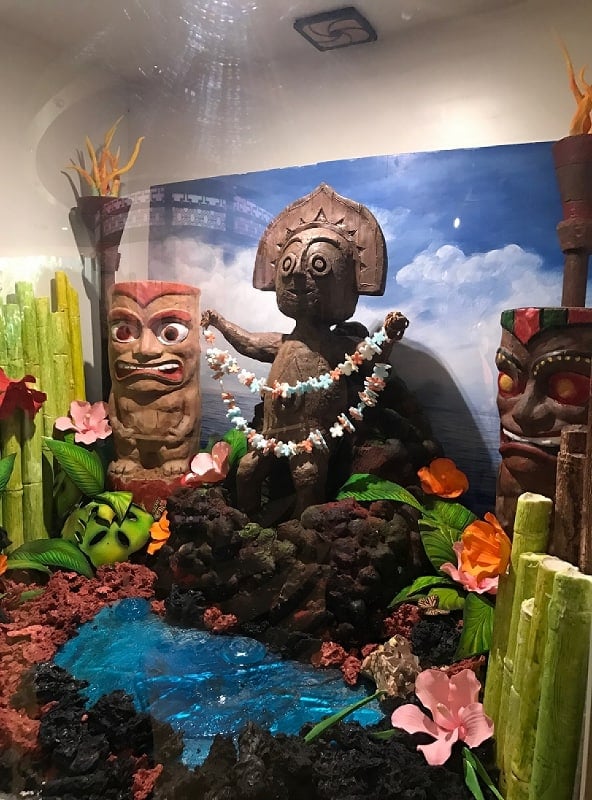
Where is `fan`? This screenshot has width=592, height=800. fan is located at coordinates (332, 30).